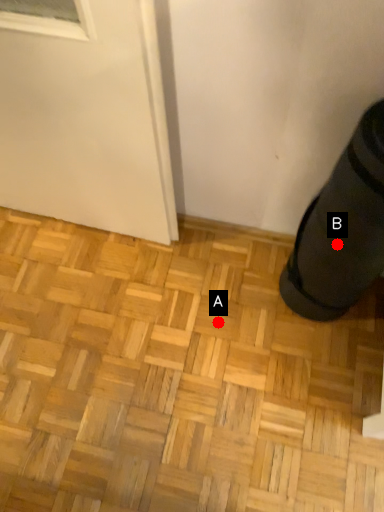
Question: Two points are circled on the image, labeled by A and B beside each circle. Which point is farther to the camera?

Choices:
 (A) A is further
 (B) B is further

Answer: (A)